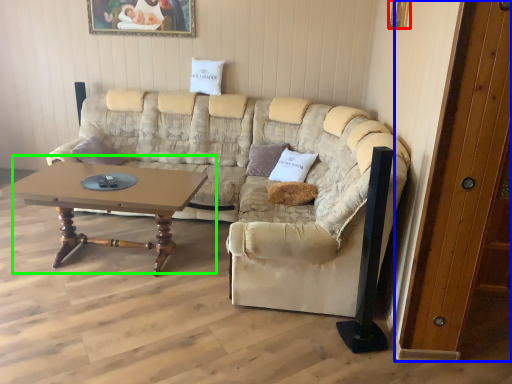
Question: Based on their relative distances, which object is nearer to picture frame (highlighted by a red box)? Choose from door (highlighted by a blue box) and coffee table (highlighted by a green box).

Choices:
 (A) door
 (B) coffee table

Answer: (A)